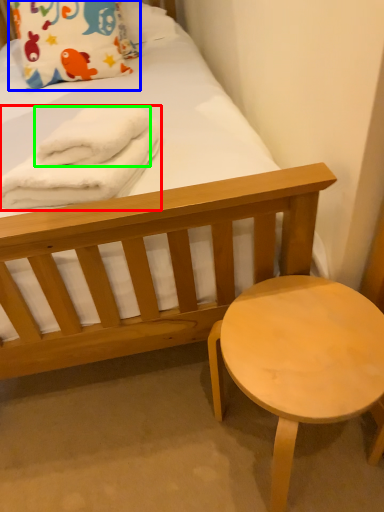
Question: Considering the real-world distances, which object is closest to bath towel (highlighted by a red box)? pillow (highlighted by a blue box) or bath towel (highlighted by a green box).

Choices:
 (A) pillow
 (B) bath towel

Answer: (B)